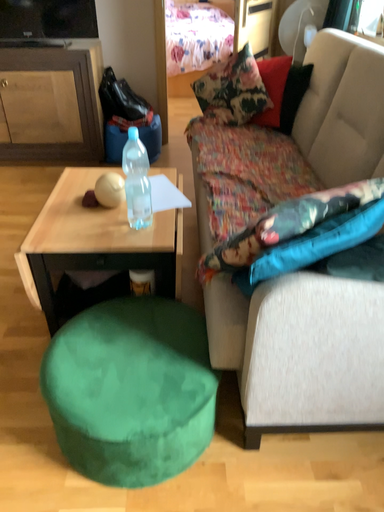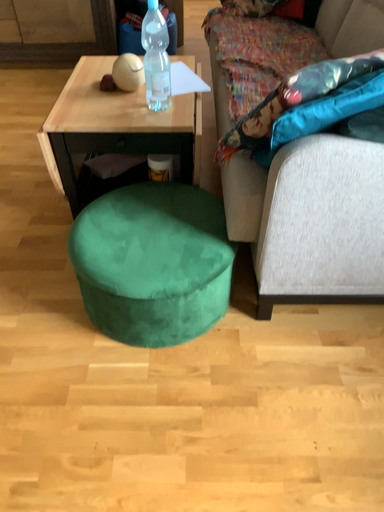
Question: How did the camera likely rotate when shooting the video?

Choices:
 (A) rotated downward
 (B) rotated upward

Answer: (A)